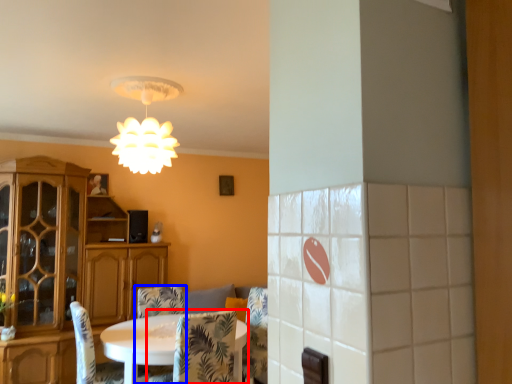
Question: Which object appears farthest to the camera in this image, chair (highlighted by a red box) or chair (highlighted by a blue box)?

Choices:
 (A) chair
 (B) chair

Answer: (B)